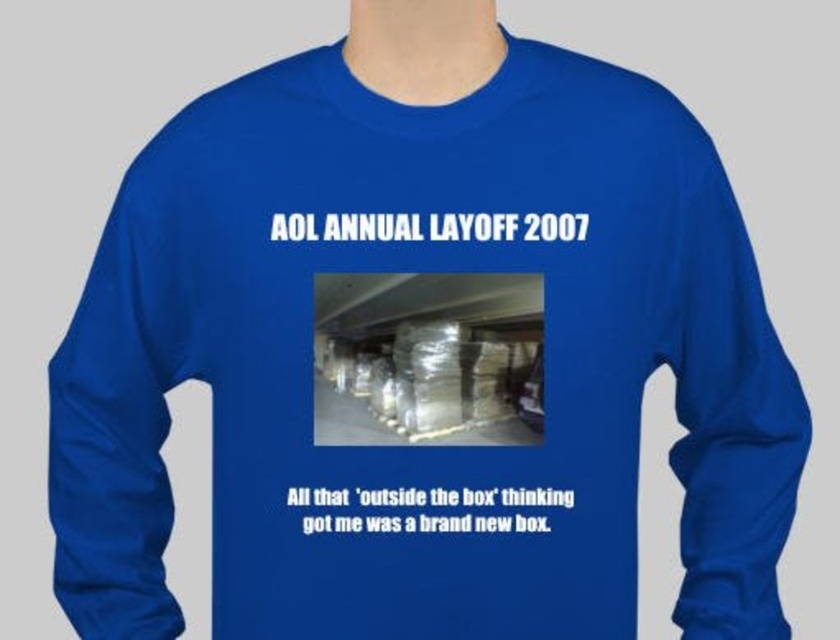
You are looking at the back of a person wearing a royal blue long sleeved shirt. The sleeves are both visible. Which sleeve is closer to you, the royal blue fabric sleeve at left or the royal blue fabric sleeve at right?

The royal blue fabric sleeve at left is closer to the viewer than the royal blue fabric sleeve at right.

You are trying to decide which sleeve of the royal blue long sleeved shirt to roll up first. The sleeves are labeled as royal blue fabric sleeve at left and royal blue fabric sleeve at right. Based on their heights, which sleeve should you start with?

The royal blue fabric sleeve at left is shorter than the royal blue fabric sleeve at right, so you should start rolling up the royal blue fabric sleeve at left first since it is shorter.